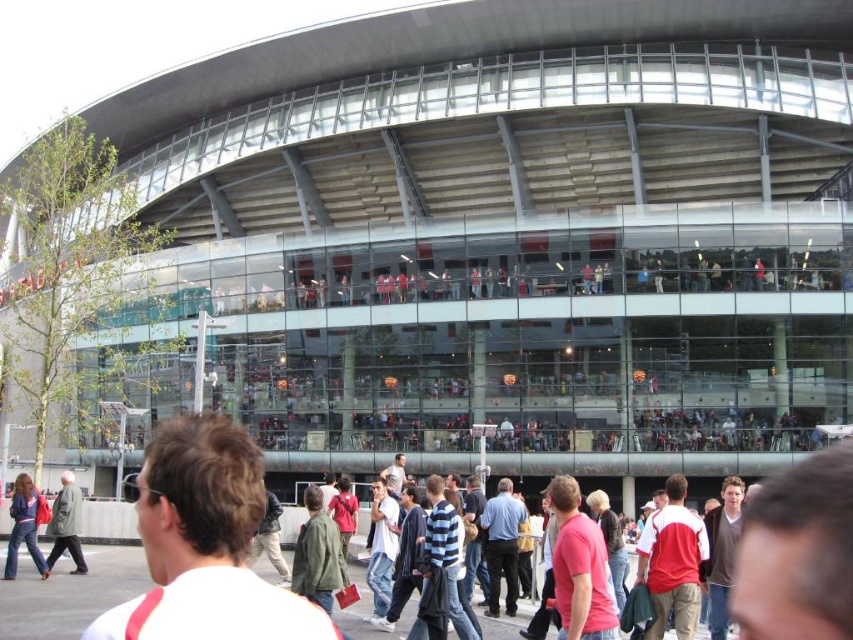
From the picture: You are standing at the center of the stadium entrance and see a person wearing a denim jacket at lower left. Where is the denim jacket located relative to your position?

The denim jacket at lower left is located at the lower left position relative to your viewpoint, as its 2D coordinates are at point 0.823 on the x axis and 0.029 on the y axis.